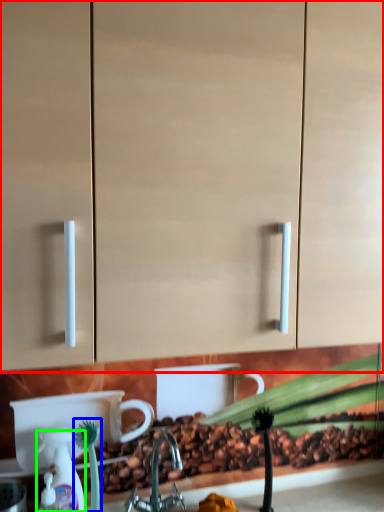
Question: Estimate the real-world distances between objects in this image. Which object is farther from cabinetry (highlighted by a red box), plant (highlighted by a blue box) or soap dispenser (highlighted by a green box)?

Choices:
 (A) plant
 (B) soap dispenser

Answer: (B)